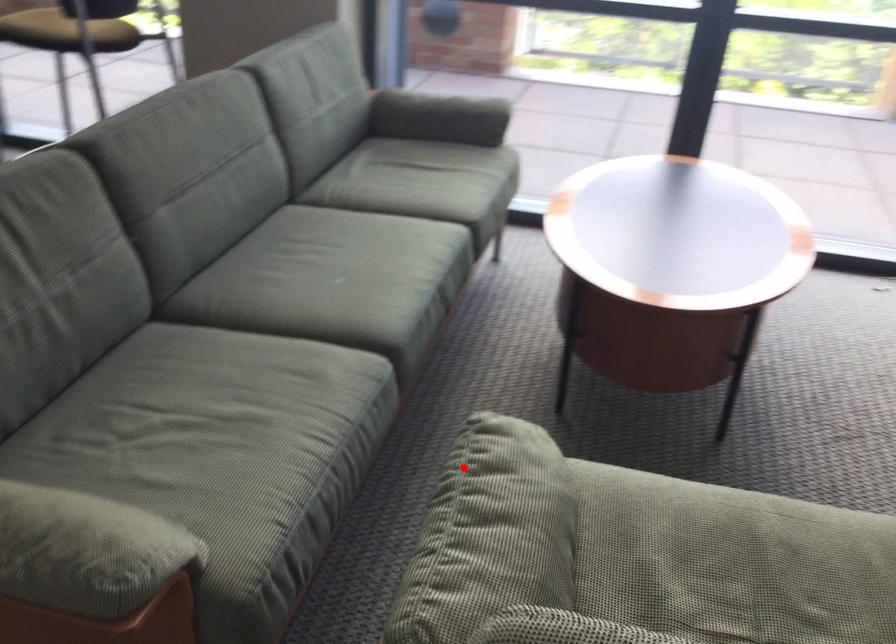
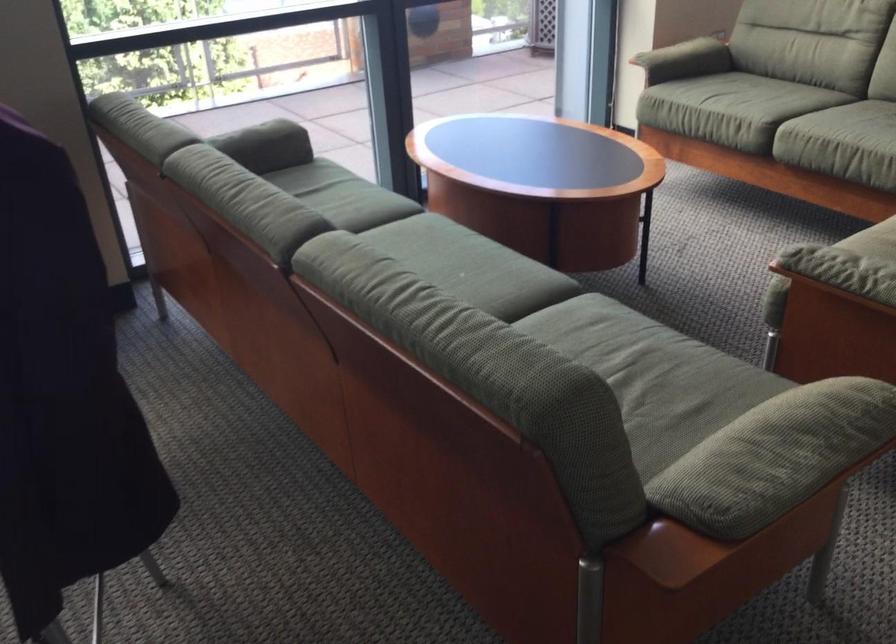
Question: I am providing you with two images of the same scene from different viewpoints. In image1, a red point is highlighted. Considering the same 3D point in image2, which of the following is correct?

Choices:
 (A) It is closer
 (B) It is farther

Answer: (B)